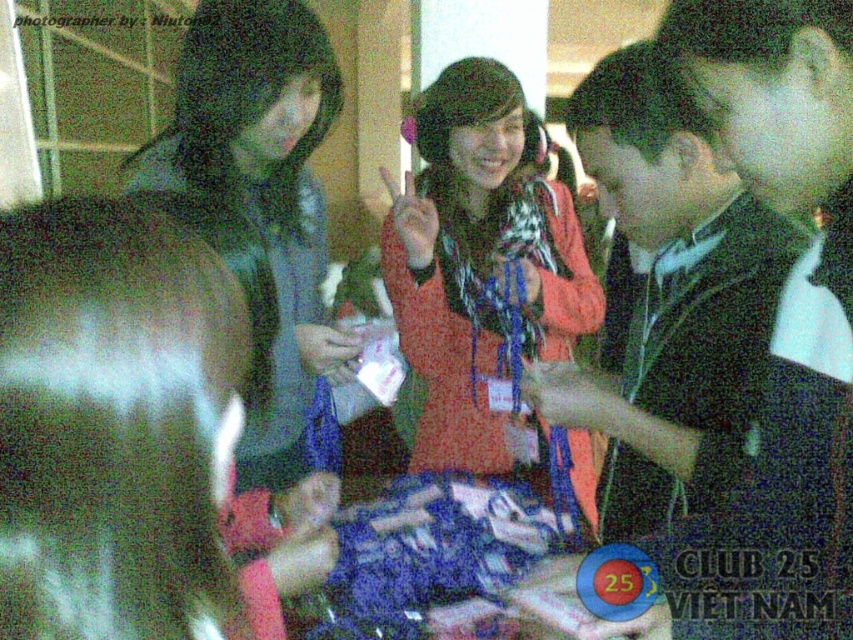
In the scene shown: You are a photographer trying to capture the exact center of the image. You notice the matte orange sweater at center is slightly off to the left. Is the sweater positioned to the left or right of the true center?

The sweater is positioned to the left of the true center because its coordinates are at point 0.425 on the x and y axes, which is less than 0.5, indicating it is slightly left and below the center.